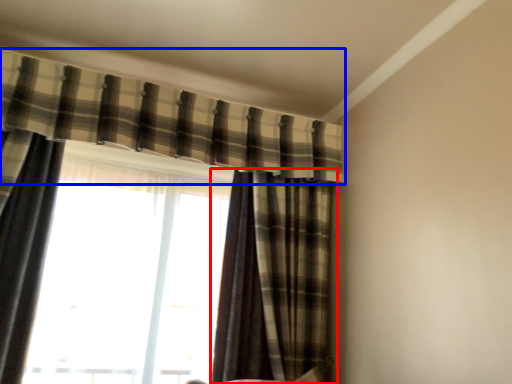
Question: Among these objects, which one is farthest to the camera, curtain (highlighted by a red box) or curtain (highlighted by a blue box)?

Choices:
 (A) curtain
 (B) curtain

Answer: (A)